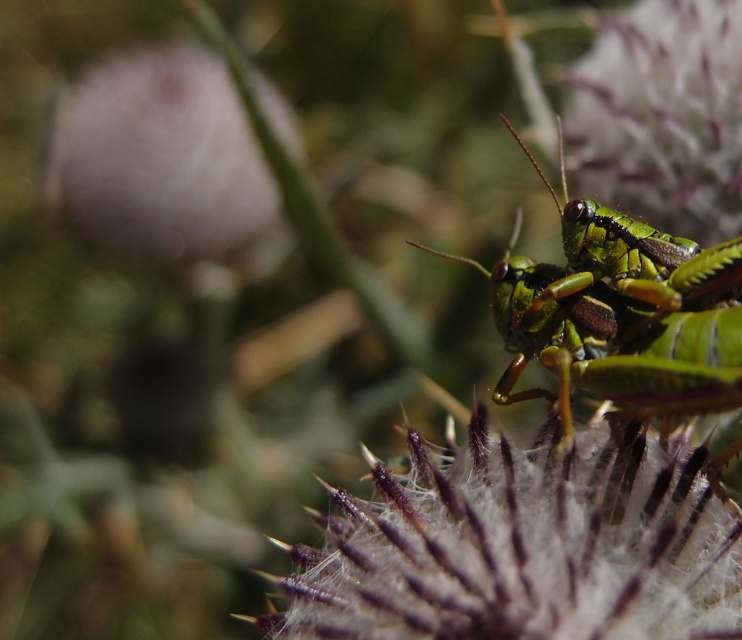
Does point (472, 595) come behind point (689, 307)?

No.

Is fuzzy white flower at center to the right of green metallic grasshopper at center from the viewer's perspective?

No, fuzzy white flower at center is not to the right of green metallic grasshopper at center.

Locate an element on the screen. This screenshot has height=640, width=742. fuzzy white flower at center is located at coordinates (522, 547).

The height and width of the screenshot is (640, 742). I want to click on fuzzy white flower at center, so click(x=522, y=547).

Is green metallic grasshopper at center below fuzzy white flower at upper left?

Indeed, green metallic grasshopper at center is positioned under fuzzy white flower at upper left.

Is green metallic grasshopper at center to the left of fuzzy white flower at upper left from the viewer's perspective?

No, green metallic grasshopper at center is not to the left of fuzzy white flower at upper left.

The height and width of the screenshot is (640, 742). Describe the element at coordinates (620, 316) in the screenshot. I see `green metallic grasshopper at center` at that location.

Identify the location of green metallic grasshopper at center. Image resolution: width=742 pixels, height=640 pixels. (620, 316).

Is fuzzy white flower at upper left further to camera compared to green matte grasshopper at upper right?

Yes, fuzzy white flower at upper left is further from the viewer.

Between fuzzy white flower at upper left and green matte grasshopper at upper right, which one is positioned lower?

Positioned lower is green matte grasshopper at upper right.

Which is in front, point (111, 220) or point (663, 179)?

Positioned in front is point (663, 179).

The width and height of the screenshot is (742, 640). Find the location of `fuzzy white flower at upper left`. fuzzy white flower at upper left is located at coordinates (162, 163).